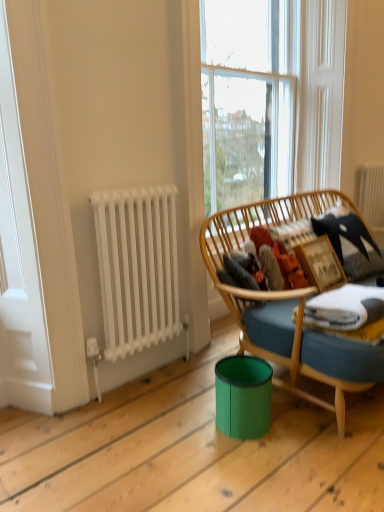
Question: Considering the relative sizes of wooden picture frame at right and clear glass window at upper center in the image provided, is wooden picture frame at right bigger than clear glass window at upper center?

Choices:
 (A) yes
 (B) no

Answer: (B)

Question: Is wooden picture frame at right in front of clear glass window at upper center?

Choices:
 (A) yes
 (B) no

Answer: (B)

Question: Is wooden picture frame at right wider than clear glass window at upper center?

Choices:
 (A) yes
 (B) no

Answer: (B)

Question: Considering the relative sizes of wooden picture frame at right and clear glass window at upper center in the image provided, is wooden picture frame at right smaller than clear glass window at upper center?

Choices:
 (A) yes
 (B) no

Answer: (A)

Question: Can you confirm if wooden picture frame at right is thinner than clear glass window at upper center?

Choices:
 (A) yes
 (B) no

Answer: (A)

Question: Does wooden picture frame at right have a lesser height compared to clear glass window at upper center?

Choices:
 (A) no
 (B) yes

Answer: (B)

Question: Is clear glass window at upper center positioned far away from white metallic radiator at left, the 1th radiator positioned from the left?

Choices:
 (A) no
 (B) yes

Answer: (A)

Question: Could you tell me if clear glass window at upper center is facing white metallic radiator at left, placed as the 1th radiator when sorted from bottom to top?

Choices:
 (A) no
 (B) yes

Answer: (A)

Question: Can you confirm if clear glass window at upper center is shorter than white metallic radiator at left, which appears as the second radiator when viewed from the right?

Choices:
 (A) no
 (B) yes

Answer: (A)

Question: Is clear glass window at upper center smaller than white metallic radiator at left, the 1th radiator positioned from the left?

Choices:
 (A) yes
 (B) no

Answer: (B)

Question: Can you confirm if clear glass window at upper center is positioned to the right of white metallic radiator at left, placed as the 1th radiator when sorted from bottom to top?

Choices:
 (A) yes
 (B) no

Answer: (A)

Question: From a real-world perspective, is clear glass window at upper center under white metallic radiator at left, which appears as the second radiator when viewed from the right?

Choices:
 (A) yes
 (B) no

Answer: (B)

Question: Is green plastic trash bin at lower center at the left side of white metallic radiator at left, placed as the 1th radiator when sorted from bottom to top?

Choices:
 (A) yes
 (B) no

Answer: (B)